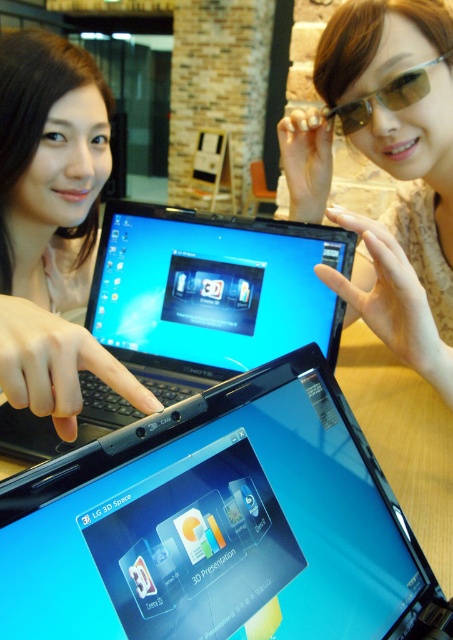
Question: Among these points, which one is nearest to the camera?

Choices:
 (A) (226, 337)
 (B) (44, 282)

Answer: (A)

Question: Which point appears closest to the camera in this image?

Choices:
 (A) (342, 605)
 (B) (49, 192)
 (C) (396, 97)
 (D) (271, 301)

Answer: (A)

Question: Does glossy plastic laptop at center appear on the right side of sunglasses at upper center?

Choices:
 (A) yes
 (B) no

Answer: (B)

Question: Observing the image, what is the correct spatial positioning of matte black laptop at left in reference to gold metallic goggles at upper right?

Choices:
 (A) left
 (B) right

Answer: (A)

Question: Estimate the real-world distances between objects in this image. Which object is closer to the glossy plastic laptop at center?

Choices:
 (A) matte black laptop at left
 (B) gold metallic goggles at upper right
 (C) sunglasses at upper center

Answer: (A)

Question: Is glossy plastic laptop at center to the right of gold metallic goggles at upper right from the viewer's perspective?

Choices:
 (A) yes
 (B) no

Answer: (B)